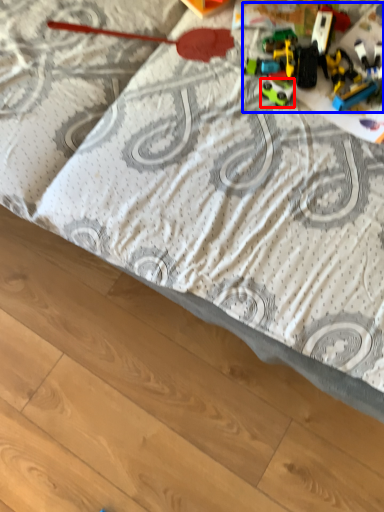
Question: Which of the following is the closest to the observer, toy (highlighted by a red box) or toy (highlighted by a blue box)?

Choices:
 (A) toy
 (B) toy

Answer: (B)